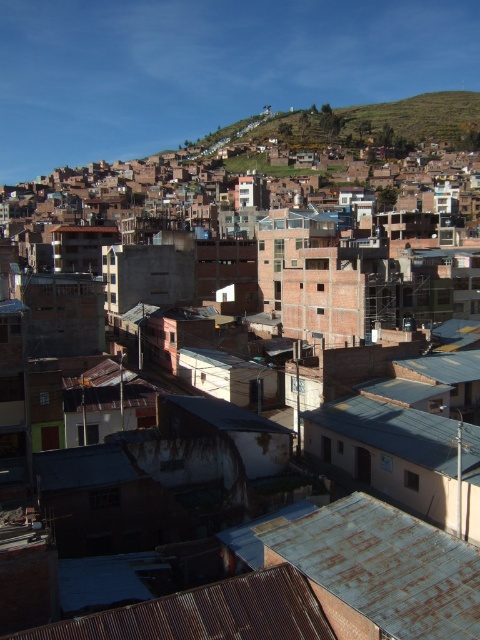
Question: Among these objects, which one is farthest from the camera?

Choices:
 (A) rusty corrugated metal roof at lower right
 (B) rusty metal roof at center

Answer: (B)

Question: Estimate the real-world distances between objects in this image. Which object is farther from the rusty metal roof at center?

Choices:
 (A) rusty corrugated metal roof at lower center
 (B) rusty corrugated metal roof at lower right

Answer: (A)

Question: Can you confirm if rusty corrugated metal roof at lower right is positioned to the left of rusty corrugated metal roof at lower center?

Choices:
 (A) yes
 (B) no

Answer: (B)

Question: Which point is closer to the camera?

Choices:
 (A) rusty corrugated metal roof at lower right
 (B) rusty metal roof at center

Answer: (A)

Question: Where is rusty corrugated metal roof at lower right located in relation to rusty corrugated metal roof at lower center in the image?

Choices:
 (A) right
 (B) left

Answer: (A)

Question: Is the position of rusty corrugated metal roof at lower right less distant than that of rusty corrugated metal roof at lower center?

Choices:
 (A) yes
 (B) no

Answer: (B)